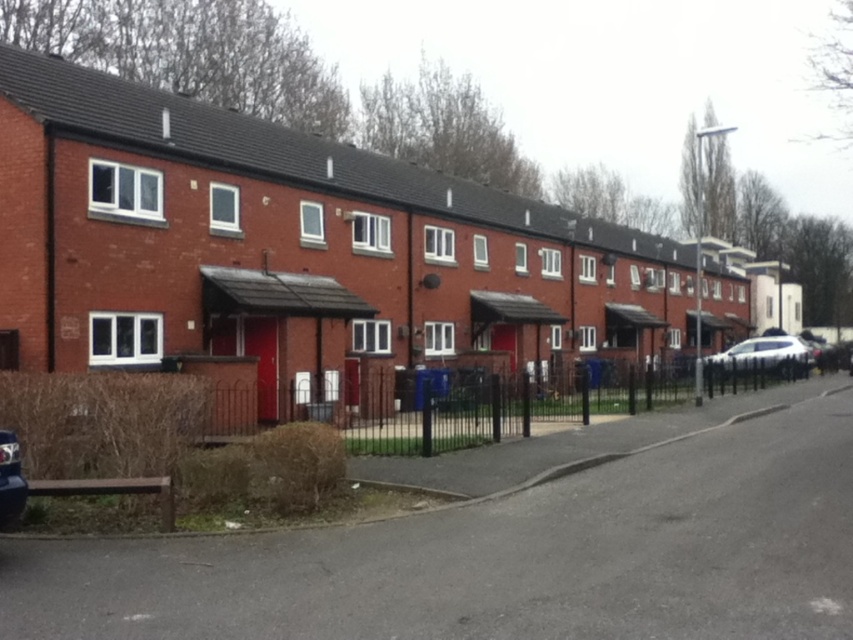
Question: Can you confirm if white glossy sedan at right is smaller than metallic silver car at lower left?

Choices:
 (A) yes
 (B) no

Answer: (B)

Question: Can you confirm if white glossy sedan at right is thinner than metallic silver car at lower left?

Choices:
 (A) yes
 (B) no

Answer: (B)

Question: Does white glossy sedan at right appear under metallic silver car at lower left?

Choices:
 (A) no
 (B) yes

Answer: (B)

Question: Which of the following is the closest to the observer?

Choices:
 (A) (743, 364)
 (B) (9, 483)

Answer: (B)

Question: Which object appears farthest from the camera in this image?

Choices:
 (A) metallic silver car at lower left
 (B) white glossy sedan at right

Answer: (B)